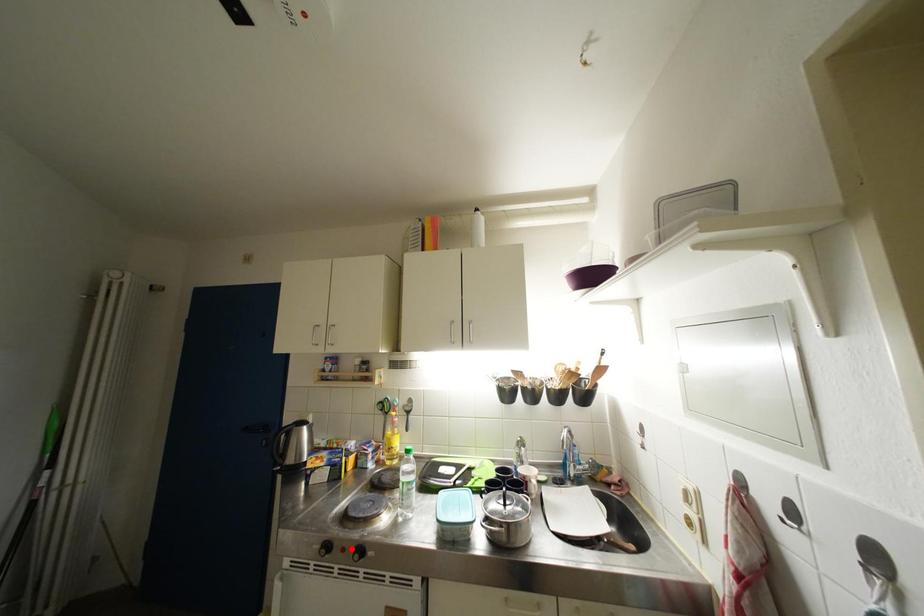
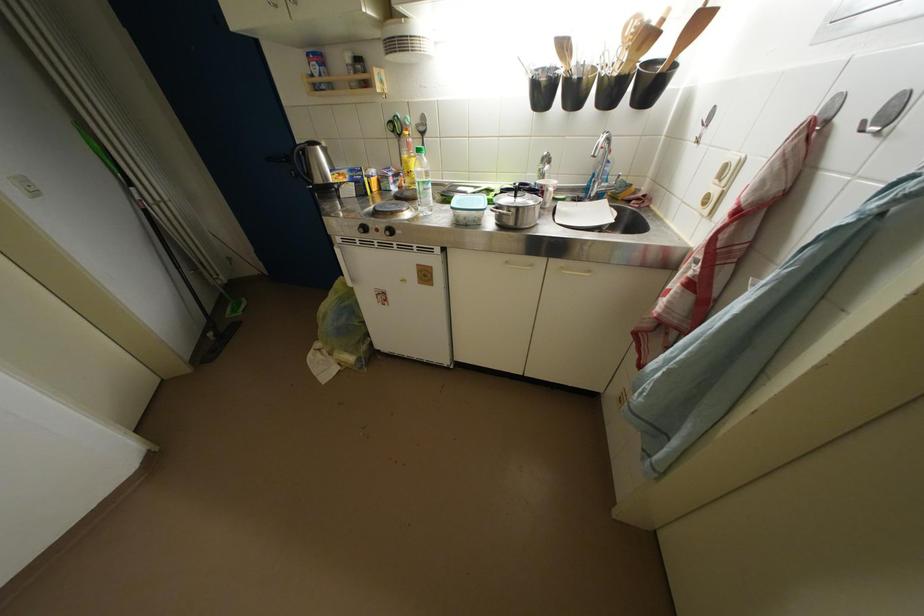
Locate, in the second image, the point that corresponds to the highlighted location in the first image.

(383, 230)